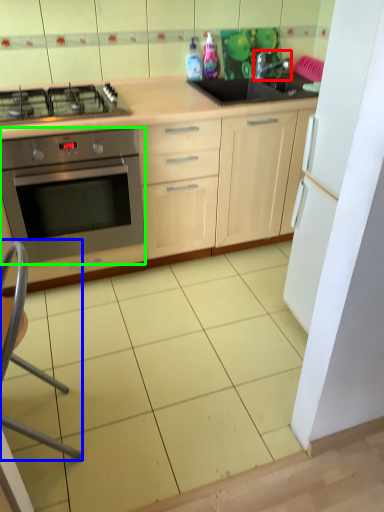
Question: Estimate the real-world distances between objects in this image. Which object is closer to tap (highlighted by a red box), folding chair (highlighted by a blue box) or oven (highlighted by a green box)?

Choices:
 (A) folding chair
 (B) oven

Answer: (B)